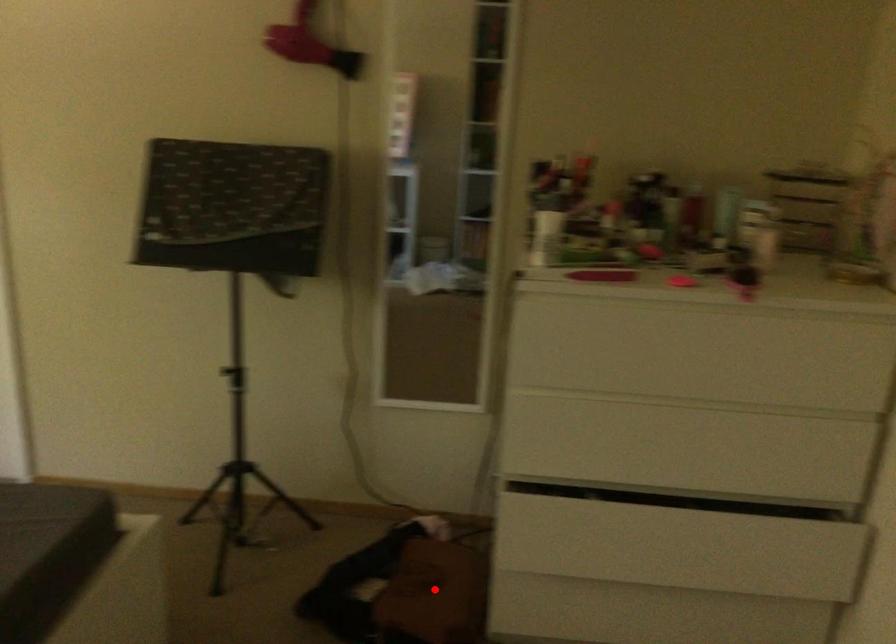
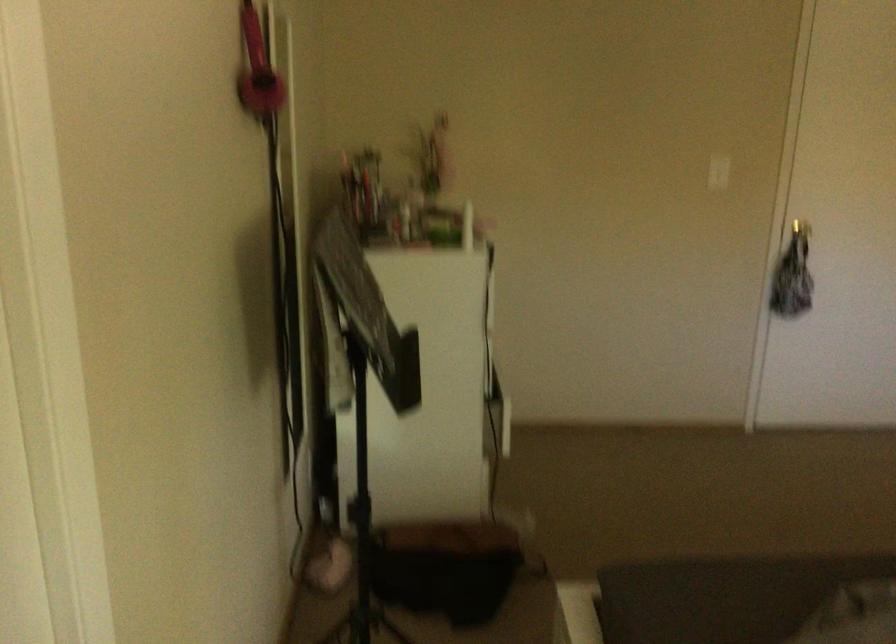
Question: I am providing you with two images of the same scene from different viewpoints. A red point is marked on the first image. At the location where the point appears in image 1, is it still visible in image 2?

Choices:
 (A) Yes
 (B) No

Answer: (B)